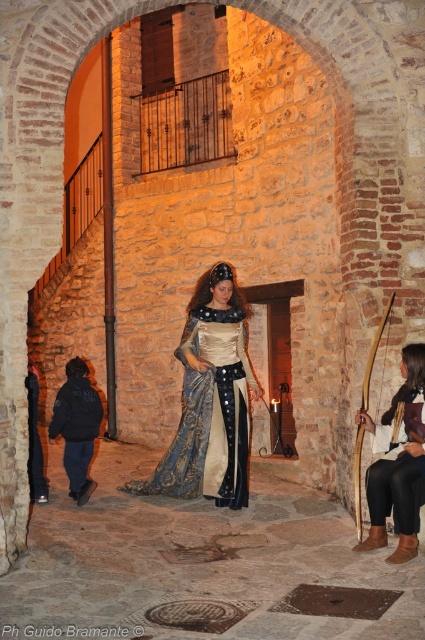
Question: Which object appears farthest from the camera in this image?

Choices:
 (A) dark blue jacket at lower left
 (B) velvet blue dress at lower right

Answer: (A)

Question: Which object is closer to the camera taking this photo?

Choices:
 (A) wooden bow at center
 (B) dark blue jacket at lower left
 (C) velvet blue dress at lower right

Answer: (C)

Question: Considering the real-world distances, which object is closest to the velvet blue dress at lower right?

Choices:
 (A) wooden bow at center
 (B) silk satin dress at center
 (C) dark blue jacket at lower left

Answer: (A)

Question: Can you confirm if velvet blue dress at lower right is wider than wooden bow at center?

Choices:
 (A) yes
 (B) no

Answer: (A)

Question: Is dark blue jacket at lower left positioned in front of wooden bow at center?

Choices:
 (A) yes
 (B) no

Answer: (B)

Question: Observing the image, what is the correct spatial positioning of velvet blue dress at lower right in reference to wooden bow at center?

Choices:
 (A) above
 (B) below

Answer: (B)